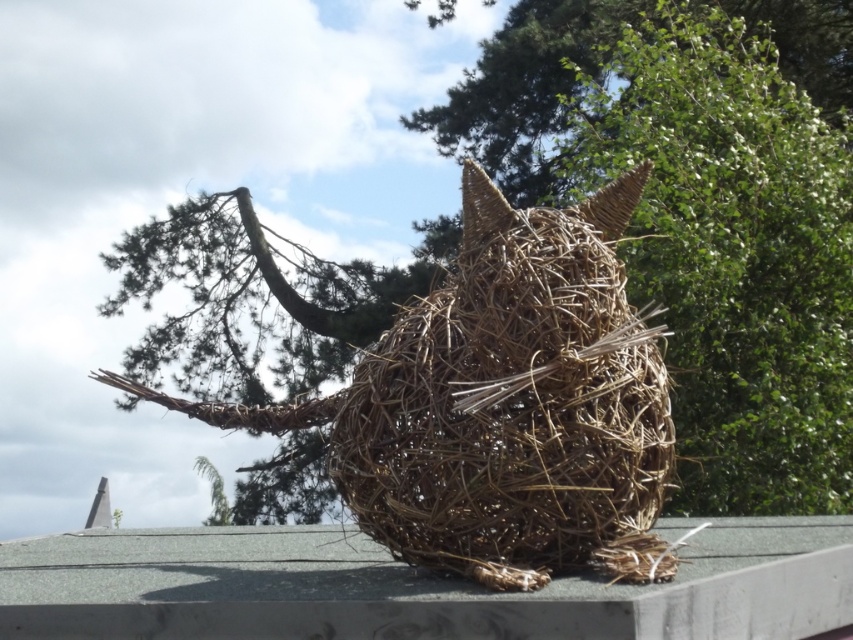
Question: Which point is farther from the camera taking this photo?

Choices:
 (A) (436, 554)
 (B) (827, 595)

Answer: (B)

Question: Considering the relative positions of braided straw cat at center and smooth concrete ledge at center in the image provided, where is braided straw cat at center located with respect to smooth concrete ledge at center?

Choices:
 (A) above
 (B) below

Answer: (A)

Question: Can you confirm if braided straw cat at center is positioned above smooth concrete ledge at center?

Choices:
 (A) no
 (B) yes

Answer: (B)

Question: Among these points, which one is nearest to the camera?

Choices:
 (A) (291, 422)
 (B) (218, 531)

Answer: (A)

Question: Which point appears farthest from the camera in this image?

Choices:
 (A) (404, 500)
 (B) (474, 593)

Answer: (A)

Question: Does braided straw cat at center appear under smooth concrete ledge at center?

Choices:
 (A) no
 (B) yes

Answer: (A)